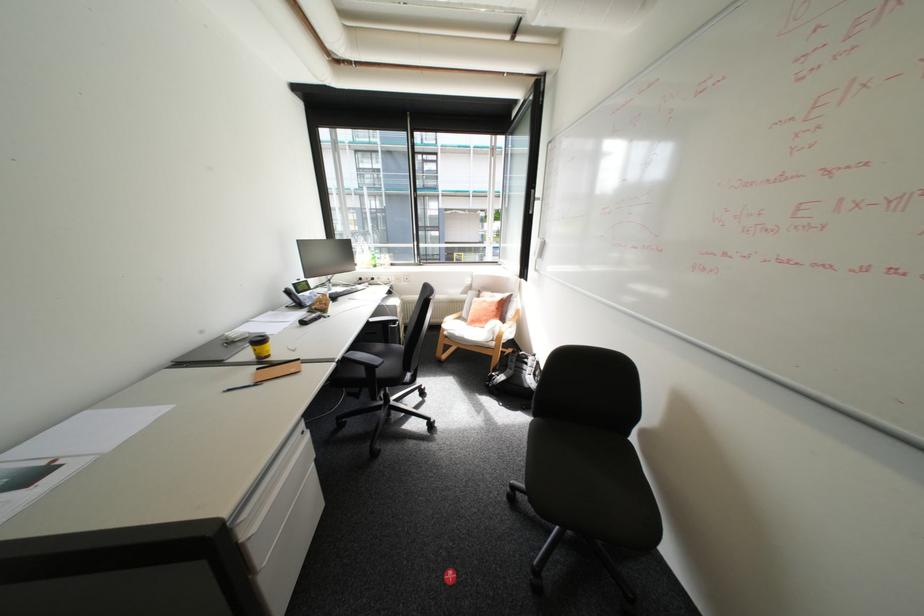
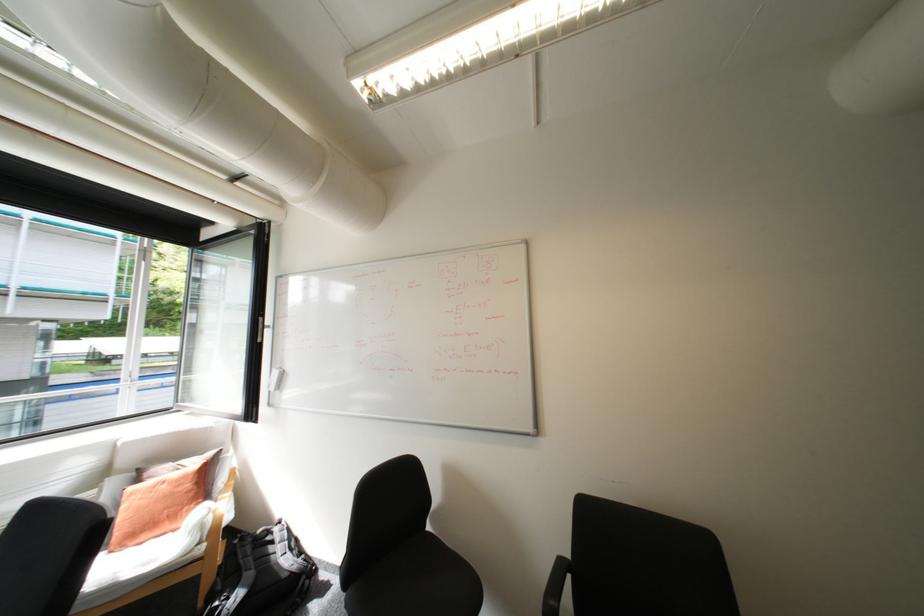
Question: The camera is either moving clockwise (left) or counter-clockwise (right) around the object. The first image is from the beginning of the video and the second image is from the end. Is the camera moving left or right when shooting the video?

Choices:
 (A) Left
 (B) Right

Answer: (A)